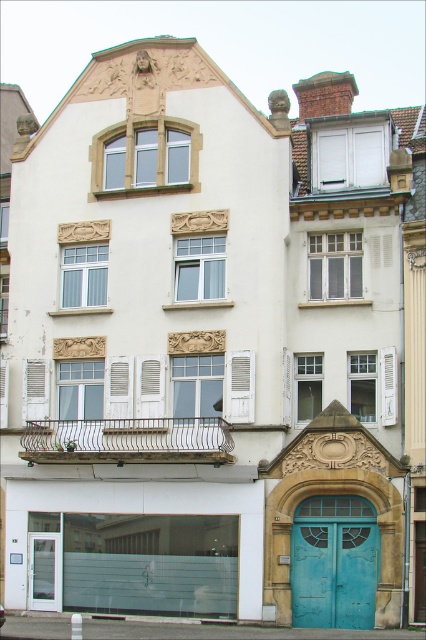
Question: Which point appears farthest from the camera in this image?

Choices:
 (A) pos(374,525)
 (B) pos(34,554)

Answer: (B)

Question: Does teal painted wood door at center appear under clear glass door at lower left?

Choices:
 (A) no
 (B) yes

Answer: (A)

Question: Is the position of teal painted wood door at center less distant than that of clear glass door at lower left?

Choices:
 (A) no
 (B) yes

Answer: (B)

Question: From the image, what is the correct spatial relationship of teal painted wood door at center in relation to clear glass door at lower left?

Choices:
 (A) right
 (B) left

Answer: (A)

Question: Among these objects, which one is farthest from the camera?

Choices:
 (A) clear glass door at lower left
 (B) teal painted wood door at center

Answer: (A)